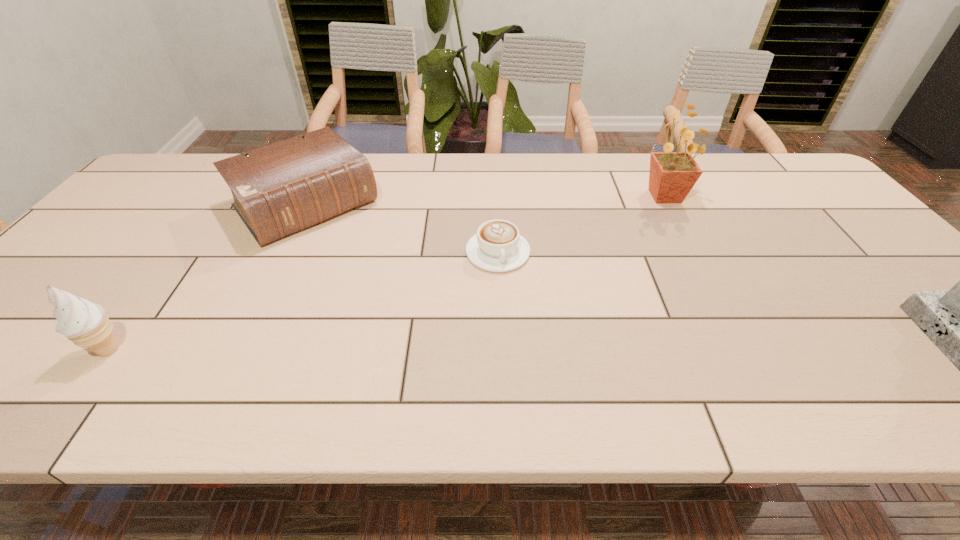
Where is `vacant space situated with the handle on the right side of the shortest object`? This screenshot has height=540, width=960. vacant space situated with the handle on the right side of the shortest object is located at coordinates (515, 291).

I want to click on vacant region located 0.090m at the front of the rightmost object with flowers visible, so click(x=639, y=220).

Identify the location of vacant area situated 0.210m at the front of the rightmost object with flowers visible. (616, 239).

Locate an element on the screen. The width and height of the screenshot is (960, 540). vacant space situated 0.160m at the front of the rightmost object with flowers visible is located at coordinates (626, 231).

I want to click on vacant space located 0.400m on the spine side of the Bible, so click(420, 334).

The image size is (960, 540). Find the location of `vacant space located 0.220m on the spine side of the Bible`. vacant space located 0.220m on the spine side of the Bible is located at coordinates (379, 287).

The height and width of the screenshot is (540, 960). I want to click on vacant space located 0.190m on the spine side of the Bible, so click(373, 280).

Where is `sunflower at the far edge`? The height and width of the screenshot is (540, 960). sunflower at the far edge is located at coordinates (672, 175).

At what (x,y) coordinates should I click in order to perform the action: click on Bible at the far edge. Please return your answer as a coordinate pair (x, y). Looking at the image, I should click on (280, 189).

This screenshot has width=960, height=540. In order to click on object at the near edge in this screenshot , I will do `click(83, 322)`.